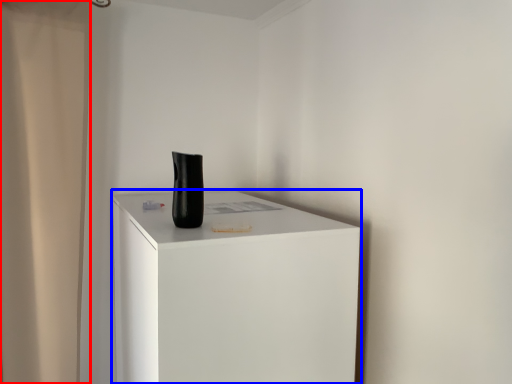
Question: Which object is further to the camera taking this photo, shower curtain (highlighted by a red box) or furniture (highlighted by a blue box)?

Choices:
 (A) shower curtain
 (B) furniture

Answer: (A)